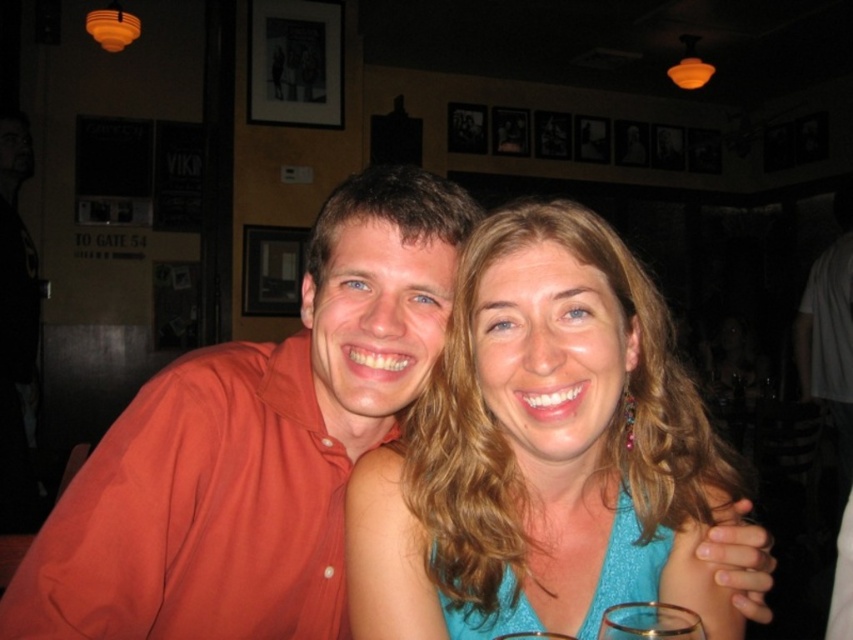
Is point (596, 547) less distant than point (621, 628)?

That is False.

Between blue fabric dress at center and transparent glass at lower center, which one appears on the right side from the viewer's perspective?

Positioned to the right is transparent glass at lower center.

Looking at this image, who is more forward, (645,308) or (602,632)?

Positioned in front is point (602,632).

Locate an element on the screen. blue fabric dress at center is located at coordinates (540, 451).

Can you confirm if orange cotton shirt at center is wider than transparent glass at lower center?

Yes.

Does point (9, 592) come farther from viewer compared to point (646, 608)?

Yes, point (9, 592) is behind point (646, 608).

The image size is (853, 640). In order to click on orange cotton shirt at center in this screenshot , I will do `click(254, 445)`.

The width and height of the screenshot is (853, 640). I want to click on orange cotton shirt at center, so click(254, 445).

Is blue fabric dress at center further to the viewer compared to orange cotton shirt at center?

That is False.

Is blue fabric dress at center smaller than orange cotton shirt at center?

Yes.

Is point (482, 492) positioned before point (461, 221)?

Yes, point (482, 492) is closer to viewer.

Identify the location of blue fabric dress at center. (540, 451).